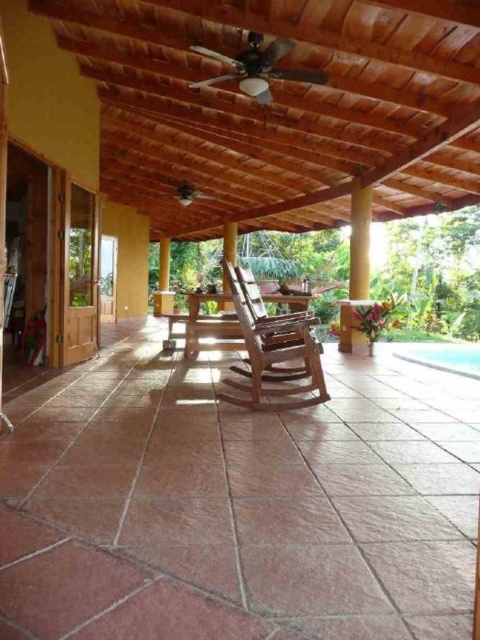
Question: Among these objects, which one is farthest from the camera?

Choices:
 (A) clear blue water at lower right
 (B) wooden rocking chair at center

Answer: (A)

Question: Does wooden rocking chair at center have a smaller size compared to clear blue water at lower right?

Choices:
 (A) yes
 (B) no

Answer: (B)

Question: Does wooden rocking chair at center appear on the left side of clear blue water at lower right?

Choices:
 (A) no
 (B) yes

Answer: (B)

Question: Which point is farther to the camera?

Choices:
 (A) (x=418, y=362)
 (B) (x=256, y=289)

Answer: (A)

Question: Can you confirm if wooden rocking chair at center is positioned to the left of clear blue water at lower right?

Choices:
 (A) yes
 (B) no

Answer: (A)

Question: Among these points, which one is nearest to the camera?

Choices:
 (A) (463, 356)
 (B) (259, 301)

Answer: (B)